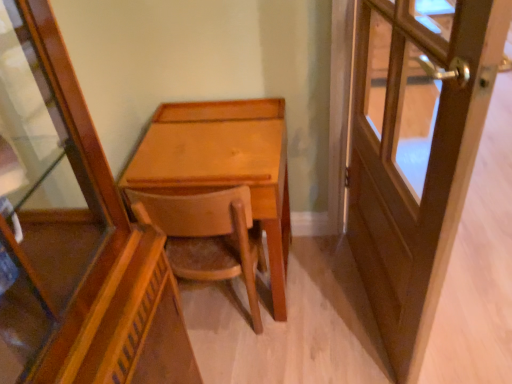
Question: Is wooden door at right wider or thinner than light brown wood desk at center?

Choices:
 (A) thin
 (B) wide

Answer: (A)

Question: From a real-world perspective, relative to light brown wood desk at center, is wooden door at right vertically above or below?

Choices:
 (A) below
 (B) above

Answer: (B)

Question: Based on their relative distances, which object is farther from the light brown wood desk at center?

Choices:
 (A) wooden door at right
 (B) wooden chair at center

Answer: (A)

Question: Which is nearer to the wooden chair at center?

Choices:
 (A) wooden door at right
 (B) light brown wood desk at center

Answer: (B)